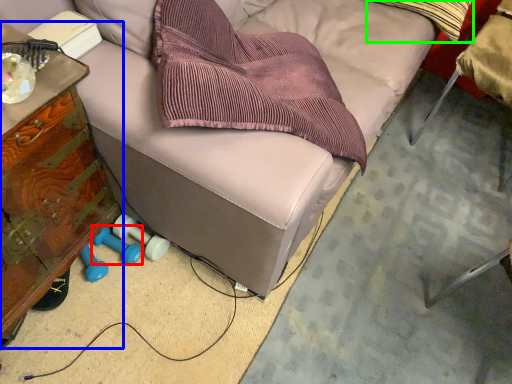
Question: Which object is positioned closest to dumbbell (highlighted by a red box)? Select from furniture (highlighted by a blue box) and throw pillow (highlighted by a green box).

Choices:
 (A) furniture
 (B) throw pillow

Answer: (A)